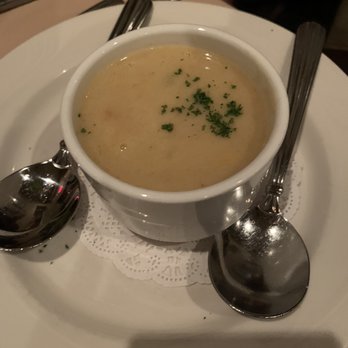
At what (x,y) coordinates should I click in order to perform the action: click on surface. Please return your answer as a coordinate pair (x, y). The width and height of the screenshot is (348, 348). Looking at the image, I should click on (62, 8).